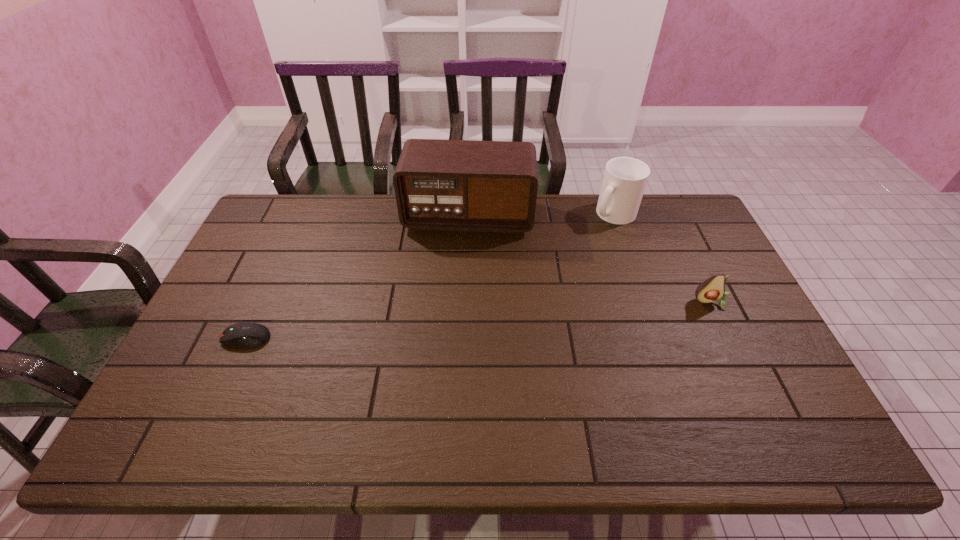
Locate an element on the screen. free space located on the handle side of the third shortest object is located at coordinates (594, 240).

This screenshot has width=960, height=540. In order to click on vacant space situated 0.400m on the handle side of the third shortest object in this screenshot , I will do `click(550, 298)`.

Find the location of a particular element. The width and height of the screenshot is (960, 540). vacant space located 0.330m on the front-facing side of the third object from right to left is located at coordinates click(x=455, y=313).

Where is `free space located on the front-facing side of the third object from right to left`? free space located on the front-facing side of the third object from right to left is located at coordinates (461, 264).

Find the location of `vacant space located 0.060m on the front-facing side of the third object from right to left`. vacant space located 0.060m on the front-facing side of the third object from right to left is located at coordinates (463, 249).

At what (x,y) coordinates should I click in order to perform the action: click on mug at the far edge. Please return your answer as a coordinate pair (x, y). Looking at the image, I should click on (625, 178).

Where is `radio receiver present at the far edge`? radio receiver present at the far edge is located at coordinates (449, 185).

The image size is (960, 540). What are the coordinates of `object that is at the left edge` in the screenshot? It's located at (248, 334).

You are a GUI agent. You are given a task and a screenshot of the screen. Output one action in this format:
    pyautogui.click(x=<x>, y=<y>)
    Task: Click on the object that is at the right edge
    The width and height of the screenshot is (960, 540).
    Given the screenshot: What is the action you would take?
    pyautogui.click(x=713, y=289)

In the image, there is a desktop. Identify the location of vacant space at the far edge. (548, 204).